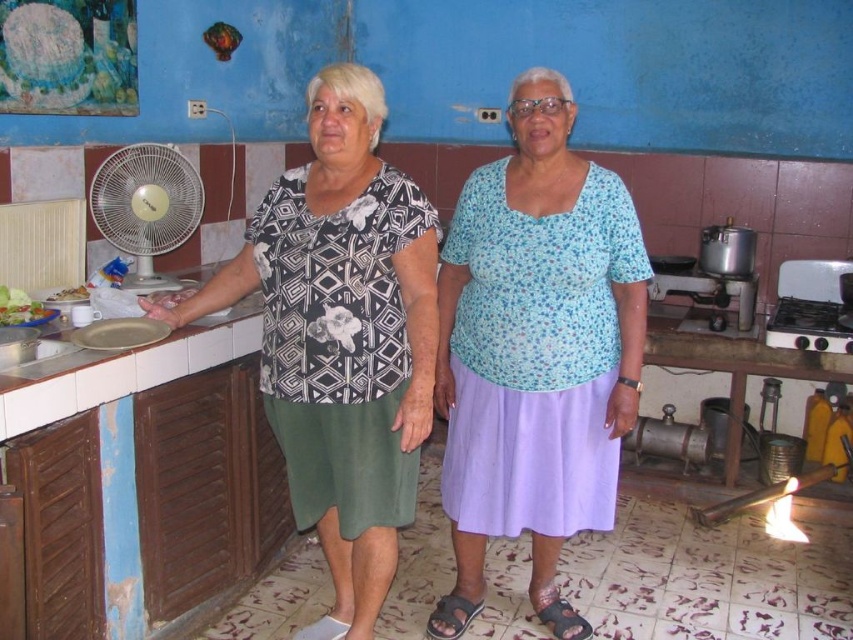
Who is shorter, matte black blouse at center or smooth white plate at left?

Standing shorter between the two is smooth white plate at left.

Can you confirm if matte black blouse at center is positioned below smooth white plate at left?

Yes.

Which is behind, point (619, 308) or point (78, 294)?

Point (78, 294)

Find the location of a particular element. matte black blouse at center is located at coordinates (x=534, y=352).

Between white plastic fan at left and white glossy sink at lower left, which one has less height?

Standing shorter between the two is white glossy sink at lower left.

Who is more forward, (x=155, y=182) or (x=4, y=356)?

Positioned in front is point (x=4, y=356).

Is point (193, 182) behind point (44, 352)?

Yes, point (193, 182) is behind point (44, 352).

Find the location of `white plastic fan at left`. white plastic fan at left is located at coordinates (146, 208).

Does blue floral blouse at center have a lesser height compared to green leafy salad at left?

No.

Is blue floral blouse at center positioned at the back of green leafy salad at left?

That is False.

Is point (524, 384) positioned behind point (3, 301)?

No, (524, 384) is closer to viewer.

Identify the location of blue floral blouse at center. (535, 352).